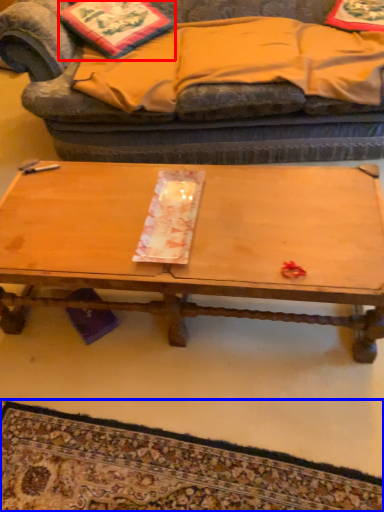
Question: Among these objects, which one is nearest to the camera, pillow (highlighted by a red box) or mat (highlighted by a blue box)?

Choices:
 (A) pillow
 (B) mat

Answer: (B)